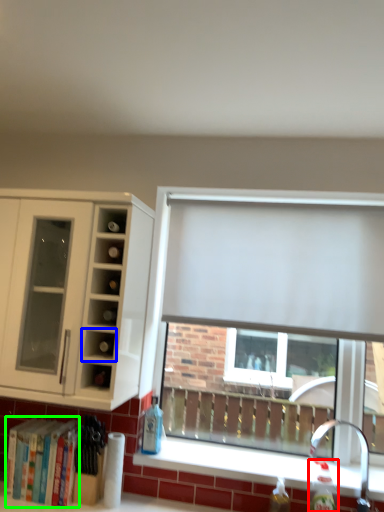
Question: Considering the real-world distances, which object is farthest from bottle (highlighted by a red box)? cabinet (highlighted by a blue box) or bookshelf (highlighted by a green box)?

Choices:
 (A) cabinet
 (B) bookshelf

Answer: (B)